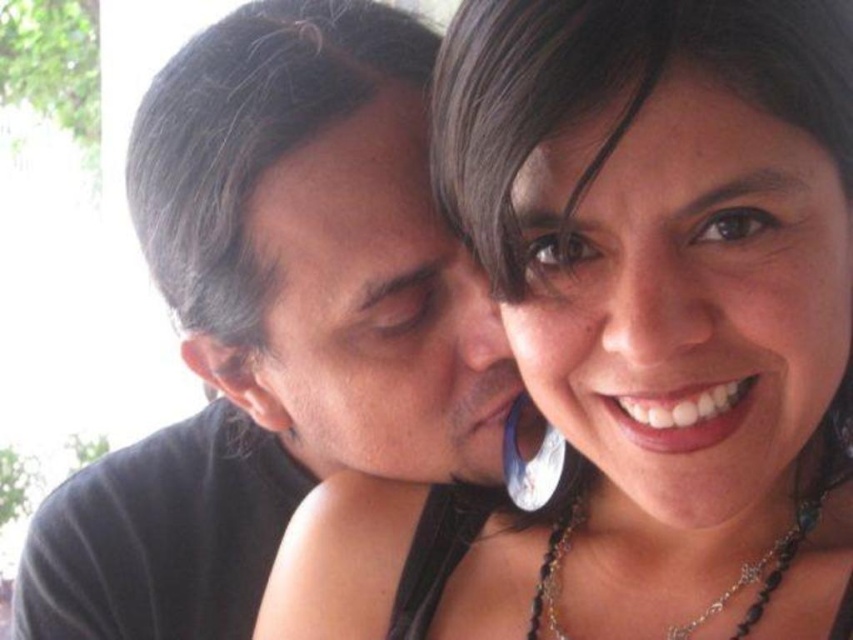
Who is lower down, matte black hair at center or black beaded necklace at lower right?

black beaded necklace at lower right is lower down.

What do you see at coordinates (631, 333) in the screenshot? The image size is (853, 640). I see `matte black hair at center` at bounding box center [631, 333].

Where is `matte black hair at center`? This screenshot has height=640, width=853. matte black hair at center is located at coordinates (631, 333).

Is matte black hair at center bigger than matte black shirt at center?

No, matte black hair at center is not bigger than matte black shirt at center.

Who is more distant from viewer, (796, 86) or (264, 452)?

The point (264, 452) is behind.

Identify the location of matte black hair at center. This screenshot has width=853, height=640. (631, 333).

Is point (163, 230) in front of point (781, 572)?

No.

Is matte black shirt at center to the right of black beaded necklace at lower right from the viewer's perspective?

In fact, matte black shirt at center is to the left of black beaded necklace at lower right.

Describe the element at coordinates (276, 321) in the screenshot. I see `matte black shirt at center` at that location.

Image resolution: width=853 pixels, height=640 pixels. I want to click on matte black shirt at center, so click(276, 321).